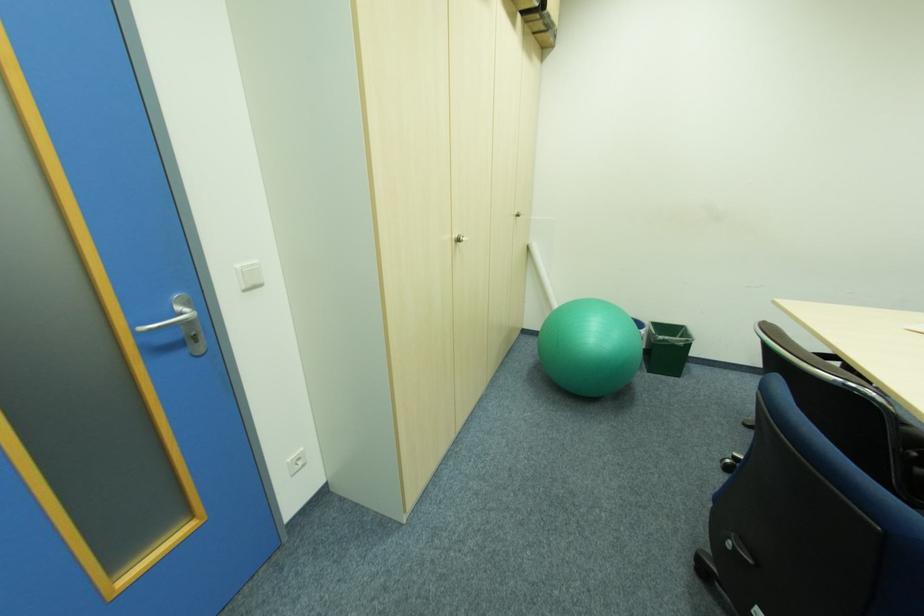
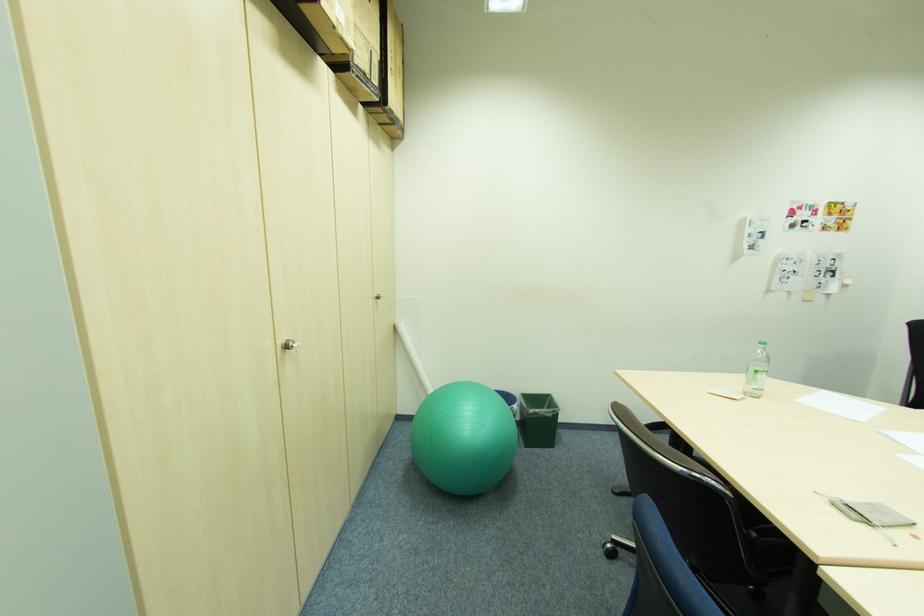
What movement of the cameraman would produce the second image?

The cameraman walked toward right, forward.